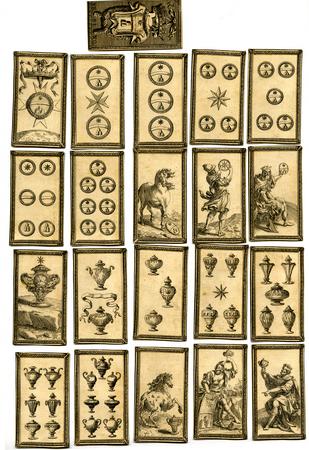
What are the coordinates of `urn` in the screenshot? It's located at 208,261, 232,261.